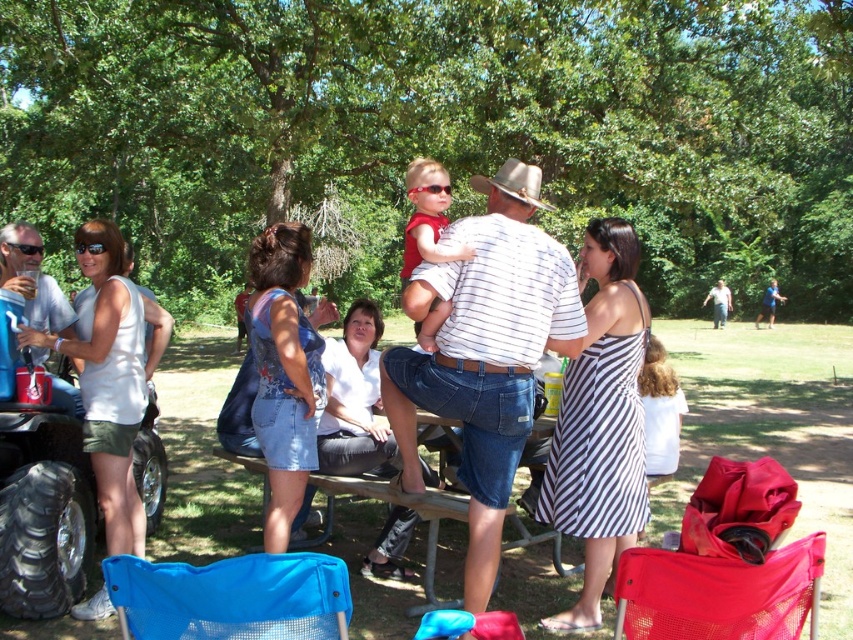
From the picture: Measure the distance from denim shorts at center to matte red shirt at center.

7.75 feet

Does denim shorts at center appear over matte red shirt at center?

Actually, denim shorts at center is below matte red shirt at center.

I want to click on denim shorts at center, so click(352, 397).

What do you see at coordinates (601, 422) in the screenshot? The image size is (853, 640). I see `black and white striped dress at center` at bounding box center [601, 422].

Who is positioned more to the left, black and white striped dress at center or brown felt cowboy hat at center?

Positioned to the left is black and white striped dress at center.

You are a GUI agent. You are given a task and a screenshot of the screen. Output one action in this format:
    pyautogui.click(x=<x>, y=<y>)
    Task: Click on the black and white striped dress at center
    
    Given the screenshot: What is the action you would take?
    pyautogui.click(x=601, y=422)

Can you confirm if striped cotton shirt at center is positioned to the left of matte red shirt at center?

In fact, striped cotton shirt at center is to the right of matte red shirt at center.

Image resolution: width=853 pixels, height=640 pixels. In order to click on striped cotton shirt at center in this screenshot , I will do `click(485, 353)`.